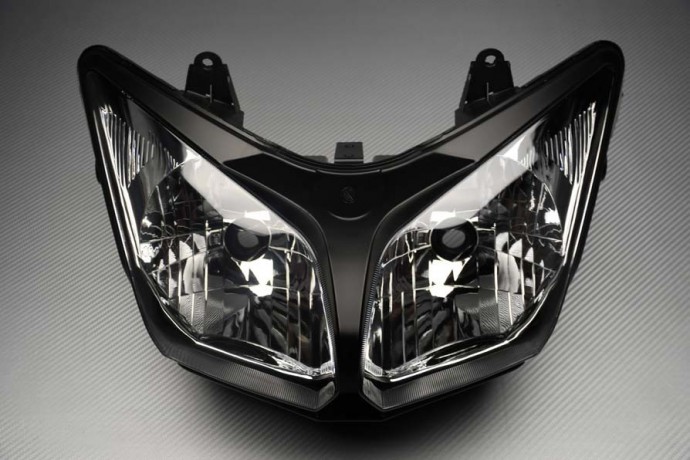
Locate an element on the screen. bracket is located at coordinates (486, 78), (354, 149), (214, 89).